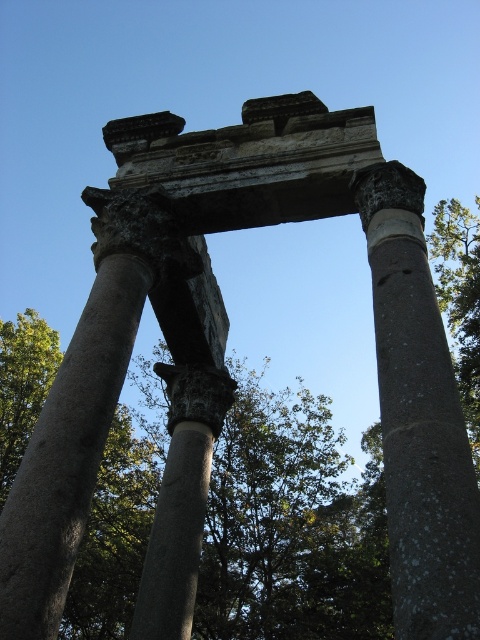
Is point (93, 499) positioned before point (396, 486)?

That is False.

The image size is (480, 640). Describe the element at coordinates (290, 525) in the screenshot. I see `green leafy tree at center` at that location.

In order to click on green leafy tree at center in this screenshot , I will do `click(290, 525)`.